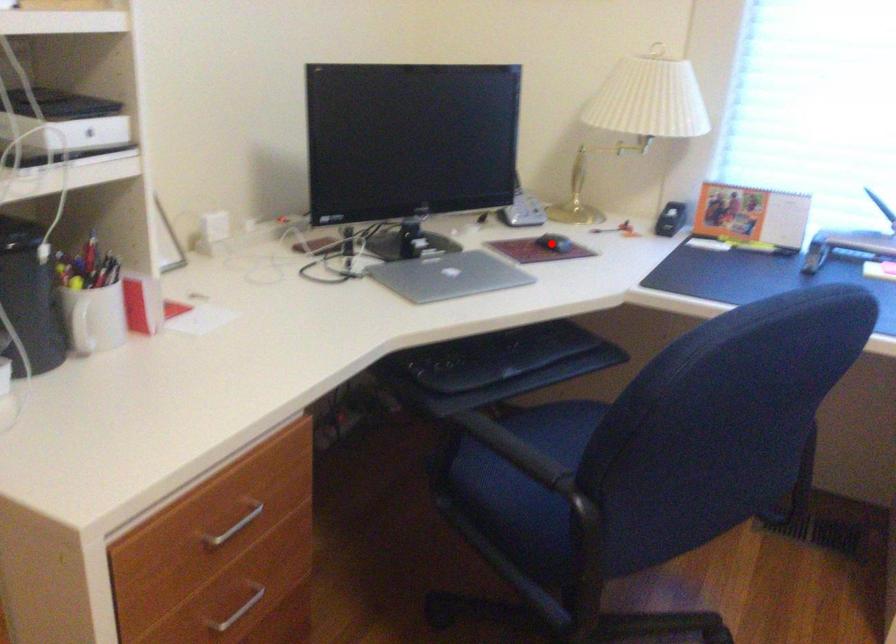
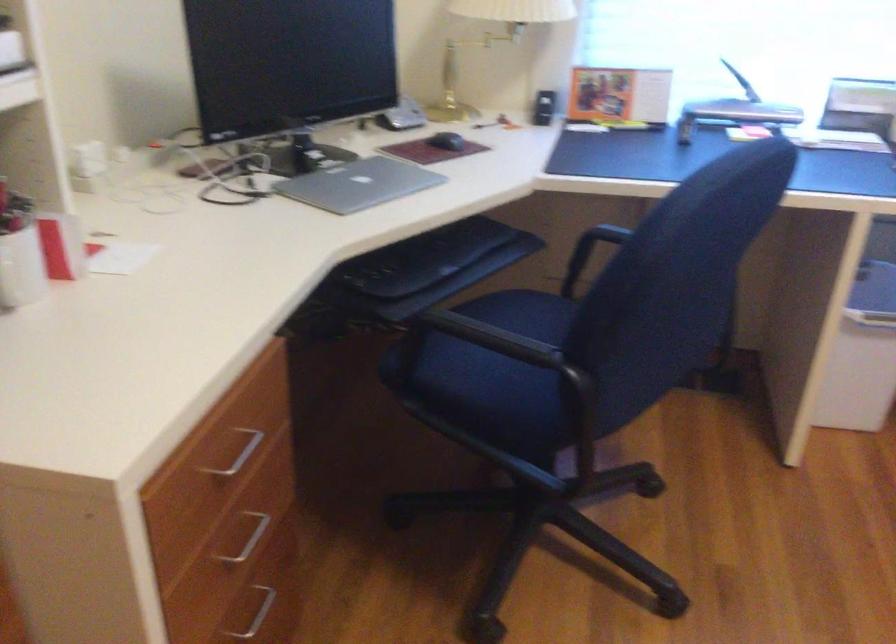
In the second image, find the point that corresponds to the highlighted location in the first image.

(446, 140)